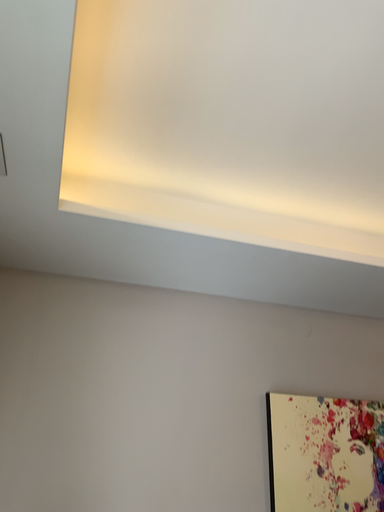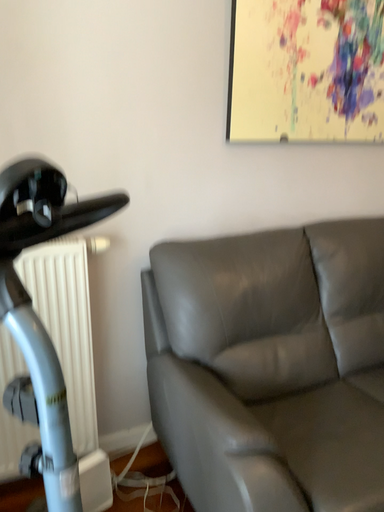
Question: How did the camera likely rotate when shooting the video?

Choices:
 (A) rotated upward
 (B) rotated downward

Answer: (B)